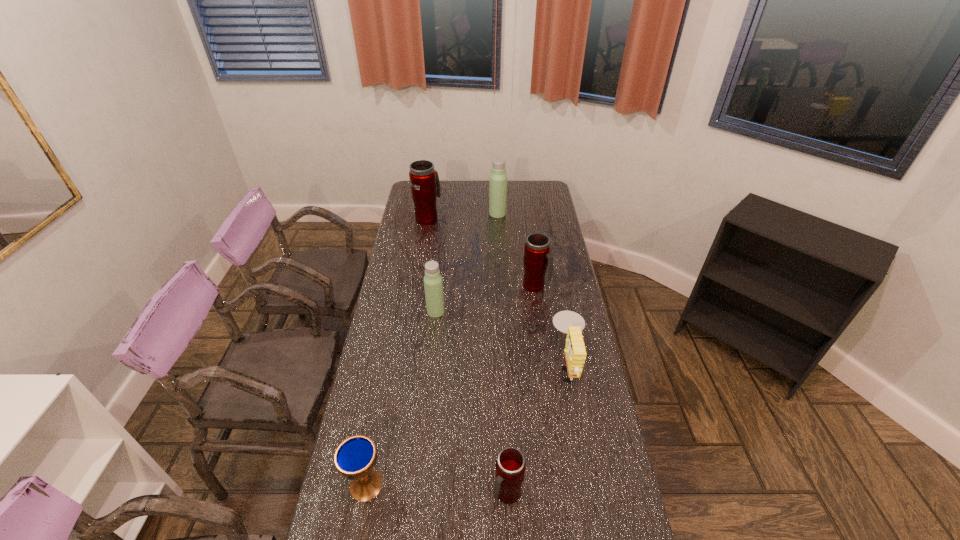
This screenshot has width=960, height=540. I want to click on free spot located on the front-facing side of the sponge, so click(459, 366).

Where is `free space located on the right of the blue chalice`? free space located on the right of the blue chalice is located at coordinates (510, 485).

Find the location of a particular element. thermos bottle that is at the left edge is located at coordinates (425, 186).

The width and height of the screenshot is (960, 540). What are the coordinates of `chalice located in the left edge section of the desktop` in the screenshot? It's located at [x=355, y=457].

You are a GUI agent. You are given a task and a screenshot of the screen. Output one action in this format:
    pyautogui.click(x=<x>, y=<y>)
    Task: Click on the thermos bottle positioned at the right edge
    This screenshot has width=960, height=540.
    Given the screenshot: What is the action you would take?
    pyautogui.click(x=537, y=257)

The width and height of the screenshot is (960, 540). Find the location of `sponge that is at the right edge`. sponge that is at the right edge is located at coordinates (569, 322).

In the image, there is a desktop. At what (x,y) coordinates should I click in order to perform the action: click on blank space at the far edge. Please return your answer as a coordinate pair (x, y). Looking at the image, I should click on (468, 190).

This screenshot has height=540, width=960. What are the coordinates of `free space at the left edge` in the screenshot? It's located at (398, 227).

This screenshot has height=540, width=960. Identify the location of vacant area at the right edge of the desktop. (589, 462).

You are a GUI agent. You are given a task and a screenshot of the screen. Output one action in this format:
    pyautogui.click(x=<x>, y=<y>)
    Task: Click on the free space between the biggest red thermos bottle and the nearest red thermos bottle
    
    Given the screenshot: What is the action you would take?
    (468, 356)